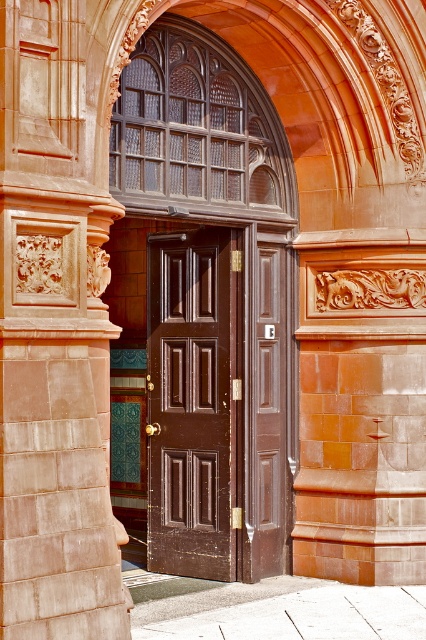
Question: Which object is closer to the camera taking this photo?

Choices:
 (A) matte brown door at center
 (B) shiny dark wood door at center

Answer: (A)

Question: Is the position of matte brown door at center less distant than that of shiny dark wood door at center?

Choices:
 (A) yes
 (B) no

Answer: (A)

Question: Does matte brown door at center appear on the left side of shiny dark wood door at center?

Choices:
 (A) yes
 (B) no

Answer: (B)

Question: Which point is farther to the camera?

Choices:
 (A) matte brown door at center
 (B) shiny dark wood door at center

Answer: (B)

Question: Which point appears farthest from the camera in this image?

Choices:
 (A) (155, 298)
 (B) (198, 246)

Answer: (A)

Question: From the image, what is the correct spatial relationship of matte brown door at center in relation to shiny dark wood door at center?

Choices:
 (A) below
 (B) above

Answer: (B)